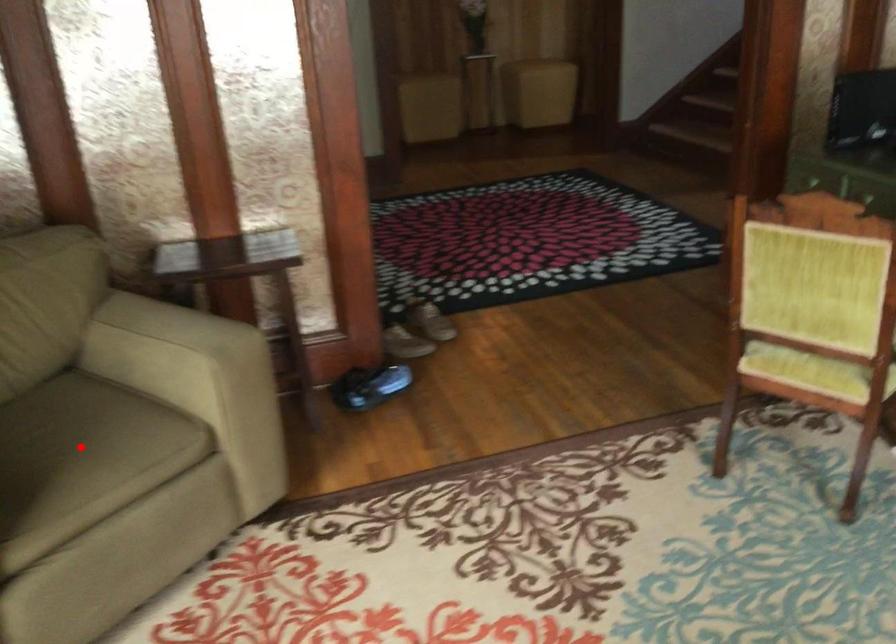
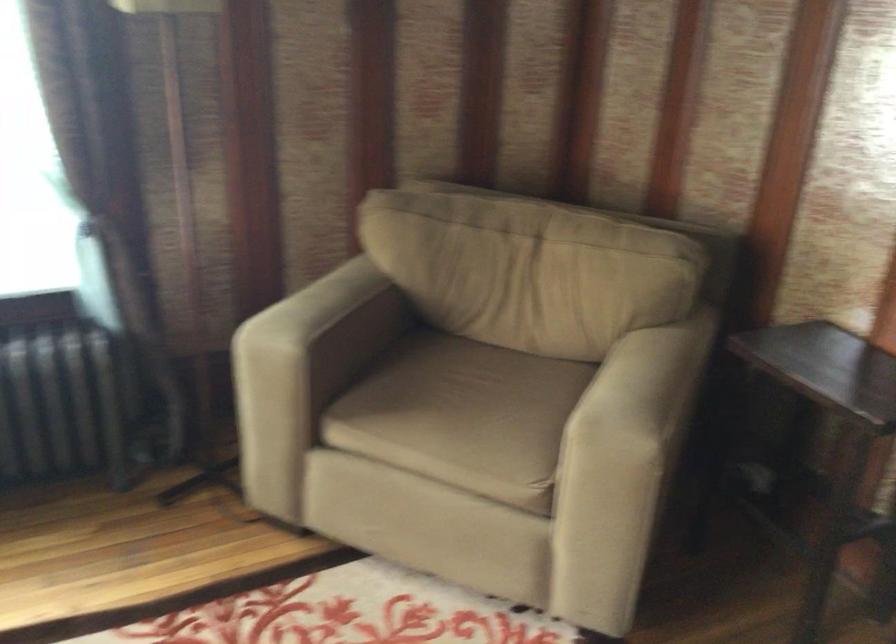
Where in the second image is the point corresponding to the highlighted location from the first image?

(458, 413)